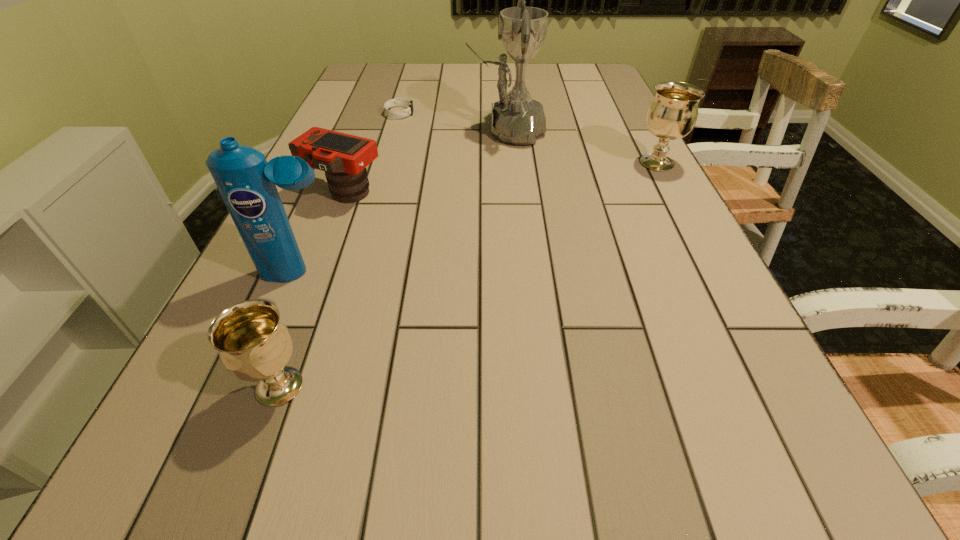
You are a GUI agent. You are given a task and a screenshot of the screen. Output one action in this format:
    pyautogui.click(x=<x>, y=<y>)
    Task: Click on the vacant space that satisfies the following two spatial constraints: 1. on the back side of the third tallest object; 2. on the left side of the shorter chalice
    The height and width of the screenshot is (540, 960).
    Given the screenshot: What is the action you would take?
    pyautogui.click(x=361, y=163)